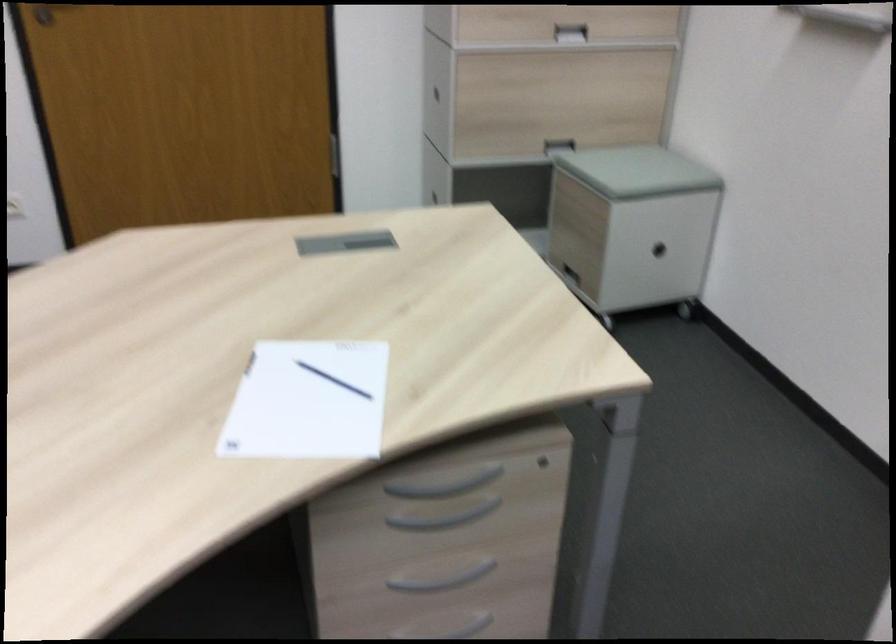
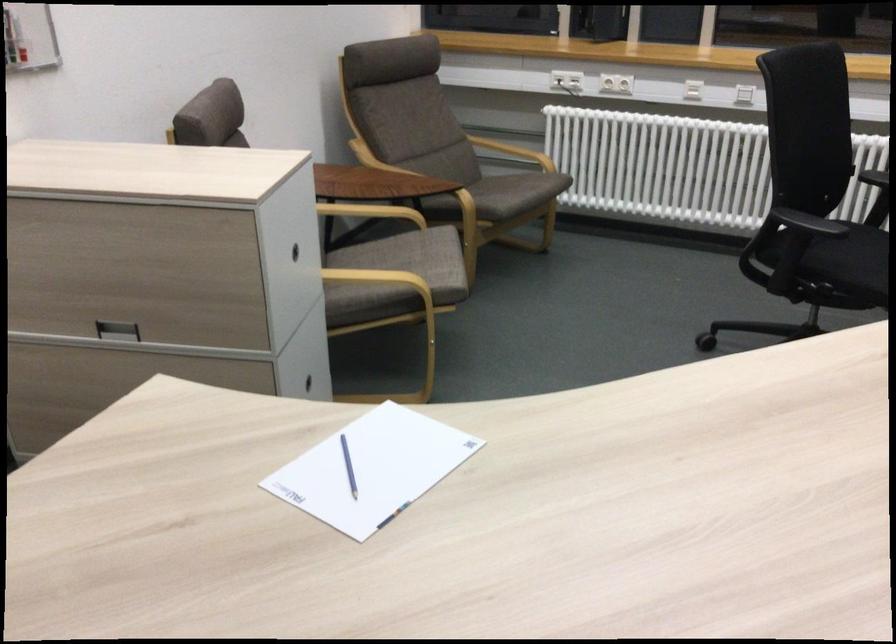
Question: I am providing you with two images of the same scene from different viewpoints. Please identify which objects are invisible in image2.

Choices:
 (A) green container
 (B) black chair sitting surface
 (C) blue pen
 (D) grey drawer handle

Answer: (D)